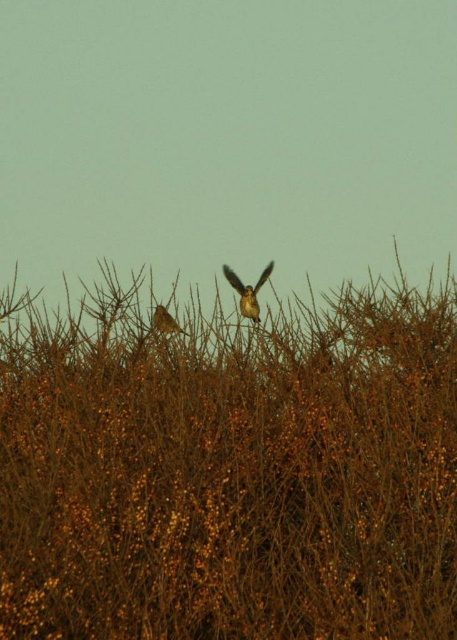
You are a photographer trying to capture both the brown textured hedge at center and the brown textured bird at center in a single frame. Based on the scene, which object is wider and might require adjusting your camera angle to ensure both fit properly?

The brown textured hedge at center might be wider than the brown textured bird at center, so you should adjust your camera angle to accommodate its width to ensure both fit in the frame.

You are standing in the natural scene and want to walk from the point at coordinates point (x=399, y=356) to the point at coordinates point (x=163, y=310). Considering the dense thicket of branches between them, will you be able to walk directly between these two points without encountering obstacles?

The point at coordinates point (x=399, y=356) is in front of point (x=163, y=310), so there is a dense thicket of branches between them. Therefore, you will encounter obstacles while walking directly between these two points.

You are an ornithologist observing the scene. You notice two birds in the image. Which one has larger physical dimensions, the brown speckled feathers at center or the brown textured bird at center?

The brown speckled feathers at center is bigger than the brown textured bird at center, so the brown speckled feathers at center has larger physical dimensions.